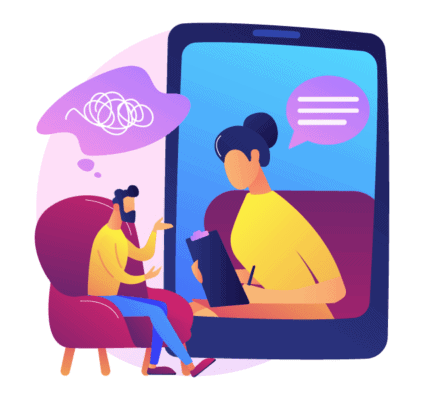
Where is `magenta one seater chair`? This screenshot has height=400, width=428. magenta one seater chair is located at coordinates (94, 321).